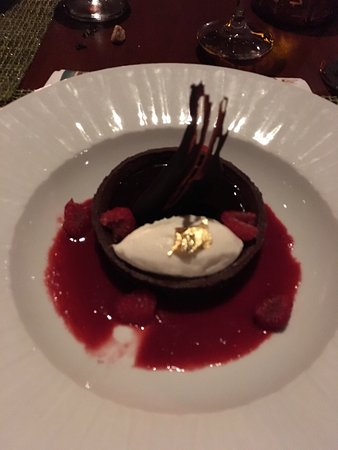
Identify the location of plate. (186, 429).